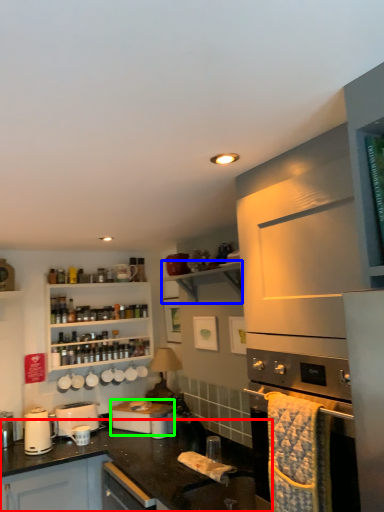
Question: Which object is positioned farthest from countertop (highlighted by a red box)? Select from shelf (highlighted by a blue box) and appliance (highlighted by a green box).

Choices:
 (A) shelf
 (B) appliance

Answer: (A)